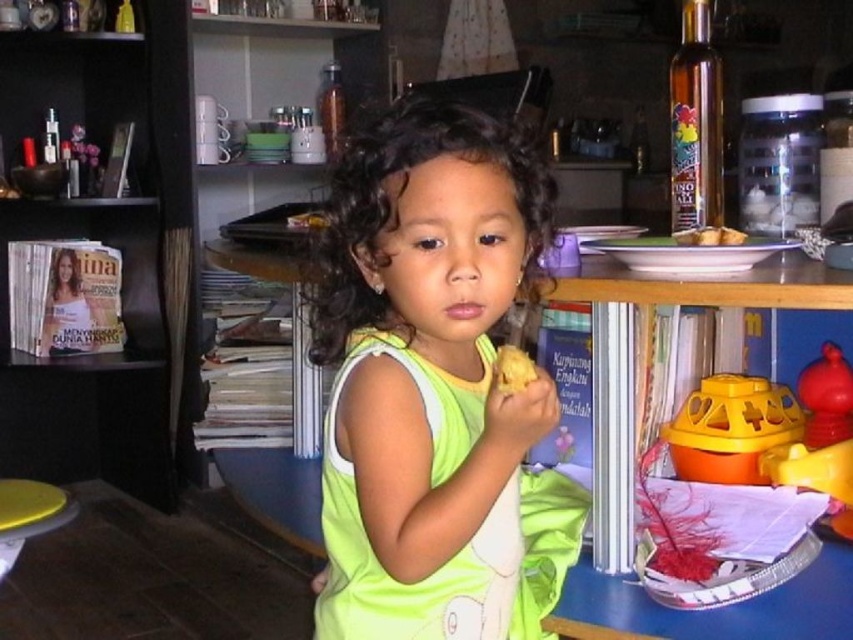
You are a delivery person who needs to place a package on the black wood bookshelf at left and the golden brown bread at right. Which object requires more horizontal space for placement?

The black wood bookshelf at left might be wider than golden brown bread at right, so it requires more horizontal space for placement.

In the scene shown: You are a photographer setting up a shoot in this room. You want to ensure both the green fabric dress at center and the black wood bookshelf at left are clearly visible in your photo. Which object should you focus on first to ensure depth of field captures both?

You should focus on the green fabric dress at center first since it is closer to the viewer. By focusing on the closer object, the depth of field will extend backward, potentially keeping both the green fabric dress at center and the black wood bookshelf at left in focus.

You are a parent trying to reach the rubberized red toy at right for your child. You see the smooth yellow stool at lower left nearby. Can you use the stool to safely reach the toy?

The rubberized red toy at right is positioned over the smooth yellow stool at lower left, so placing the stool underneath the toy would allow safe access. However, ensure the stool is stable before climbing.